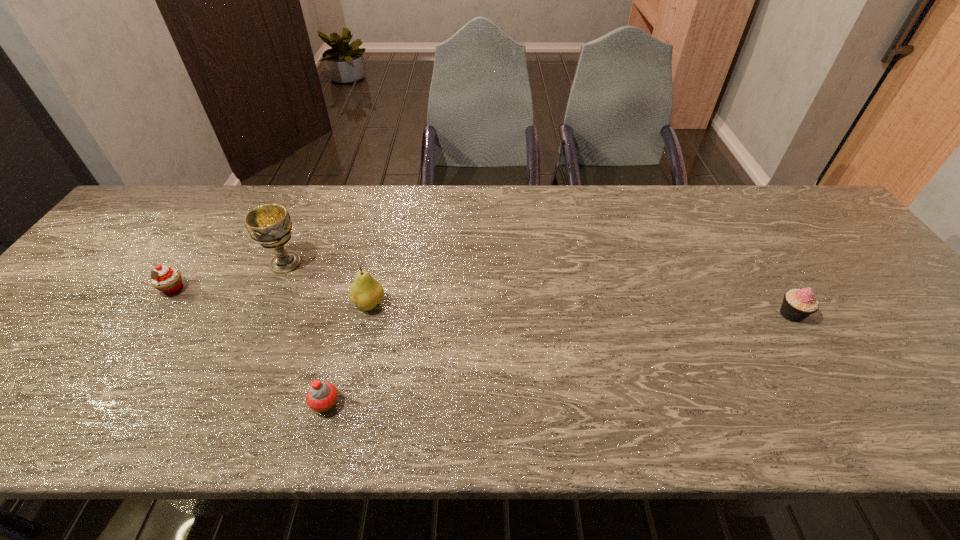
Where is `blank space located on the front of the fourth shortest object`? blank space located on the front of the fourth shortest object is located at coordinates (348, 400).

Identify the location of vacant space located 0.130m on the left of the rightmost object. (723, 314).

You are a GUI agent. You are given a task and a screenshot of the screen. Output one action in this format:
    pyautogui.click(x=<x>, y=<y>)
    Task: Click on the vacant space located 0.290m on the front of the farthest cupcake
    
    Given the screenshot: What is the action you would take?
    tap(97, 406)

Identify the location of vacant position located 0.050m on the left of the nearest cupcake. (286, 404).

Where is `object that is at the near edge`? object that is at the near edge is located at coordinates (322, 396).

In the image, there is a desktop. Where is `free space at the far edge`? free space at the far edge is located at coordinates (496, 221).

Identify the location of vacant space at the near edge of the desktop. Image resolution: width=960 pixels, height=540 pixels. point(786,424).

Where is `free space at the left edge`? The width and height of the screenshot is (960, 540). free space at the left edge is located at coordinates (65, 314).

Identify the location of free space at the far left corner of the desktop. (145, 227).

You are a GUI agent. You are given a task and a screenshot of the screen. Output one action in this format:
    pyautogui.click(x=<x>, y=<y>)
    Task: Click on the vacant point at the far right corner
    This screenshot has height=540, width=960.
    Given the screenshot: What is the action you would take?
    pyautogui.click(x=780, y=201)